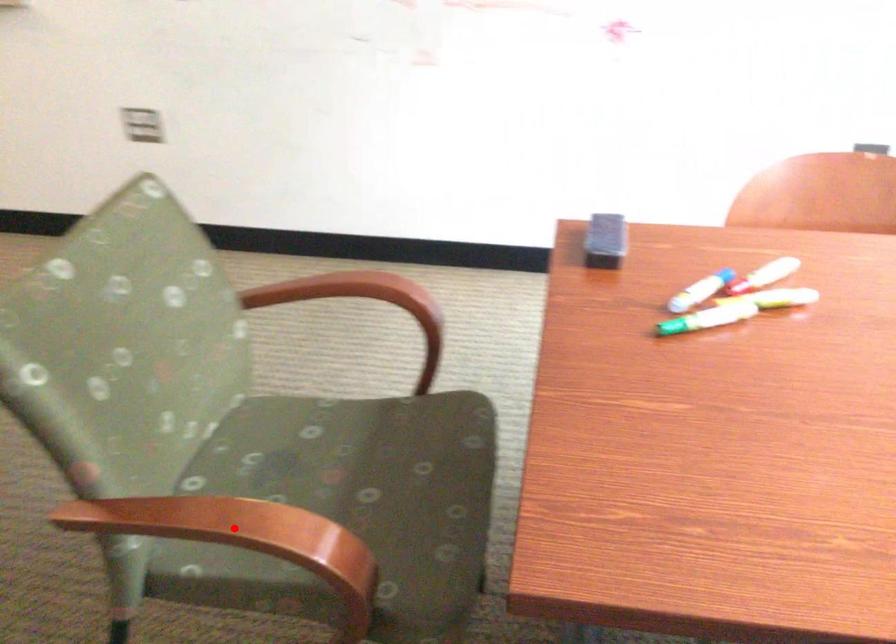
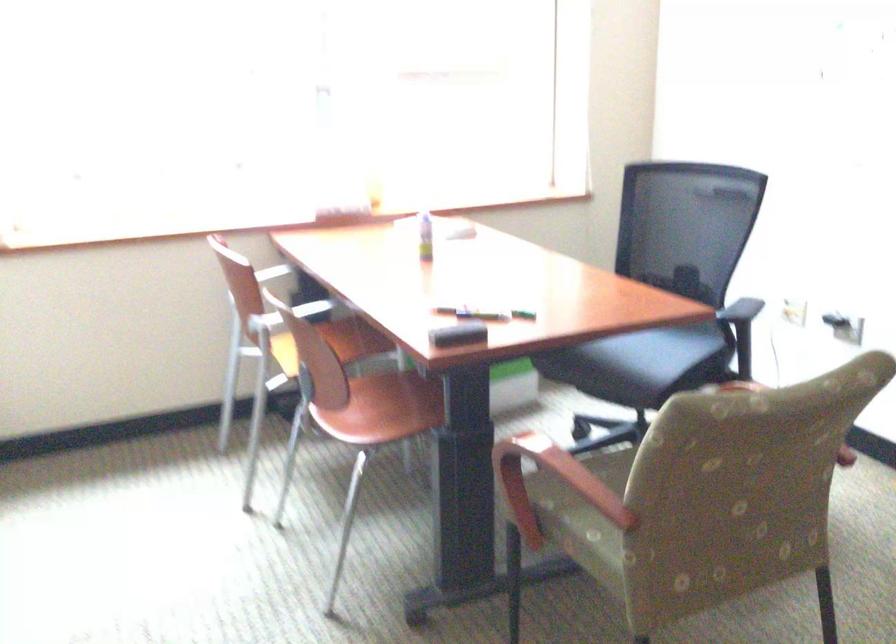
Question: I am providing you with two images of the same scene from different viewpoints. A red point is marked on the first image. Can you still see the location of the red point in image 2?

Choices:
 (A) Yes
 (B) No

Answer: (B)